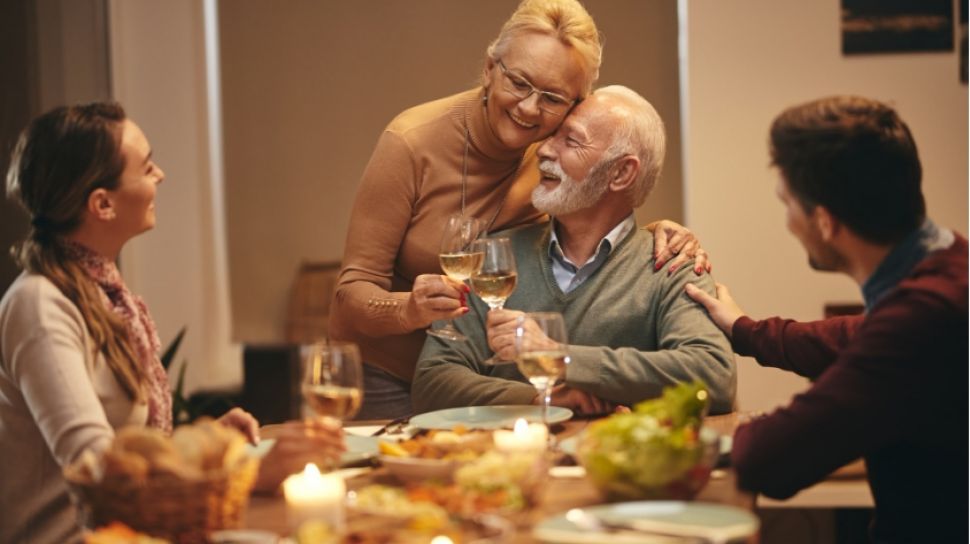
Identify the location of drinking glasses. (533, 354), (492, 272), (450, 241), (338, 375).